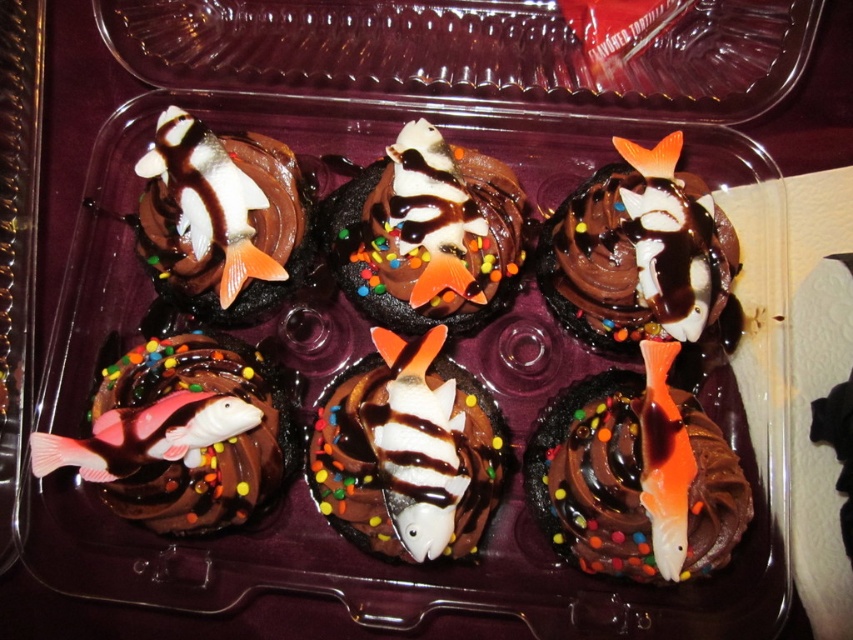
Question: Which of the following is the closest to the observer?

Choices:
 (A) (492, 269)
 (B) (579, 198)
 (C) (433, 458)

Answer: (C)

Question: Does white glossy fish at upper left appear over pink glossy fish at lower left?

Choices:
 (A) yes
 (B) no

Answer: (A)

Question: Which object is positioned farthest from the transparent plastic tray at upper center?

Choices:
 (A) pink glossy fish at bottom left
 (B) pink matte fish at center
 (C) chocolate matte fish at center

Answer: (B)

Question: From the image, what is the correct spatial relationship of transparent plastic tray at upper center in relation to pink matte fish at center?

Choices:
 (A) left
 (B) right

Answer: (B)

Question: Observing the image, what is the correct spatial positioning of white glossy fish at upper left in reference to orange glossy fish at bottom right?

Choices:
 (A) left
 (B) right

Answer: (A)

Question: Which object is positioned closest to the pink matte fish at center?

Choices:
 (A) white glossy fish at upper left
 (B) orange glossy fish at bottom right
 (C) chocolate matte cake at center
 (D) pink glossy fish at lower left

Answer: (D)